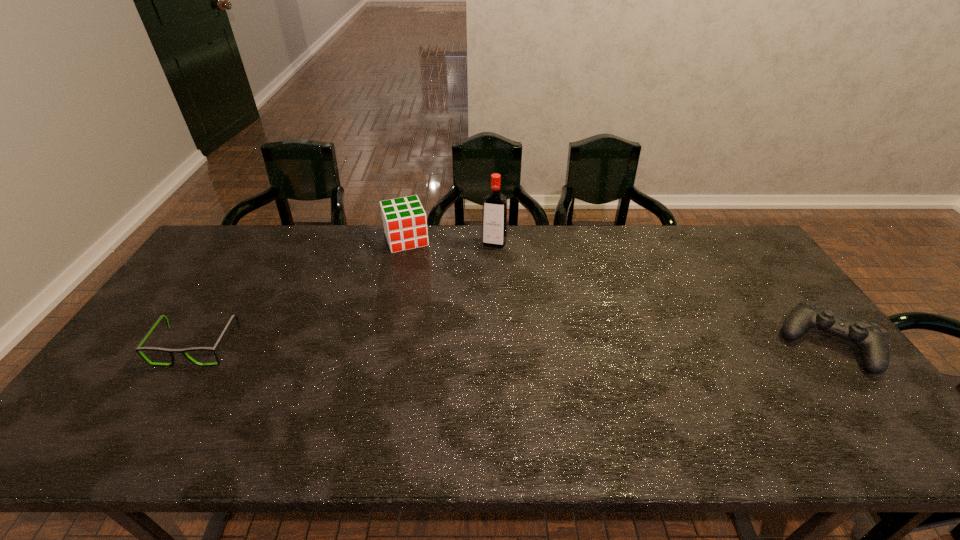
You are a GUI agent. You are given a task and a screenshot of the screen. Output one action in this format:
    pyautogui.click(x=<x>, y=<y>)
    Task: Click on the vacant area that lies between the control and the third shortest object
    
    Given the screenshot: What is the action you would take?
    pyautogui.click(x=617, y=292)

I want to click on free space between the tallest object and the cube, so pos(450,241).

Locate an element on the screen. The image size is (960, 540). empty space that is in between the shortest object and the second tallest object is located at coordinates (301, 293).

Find the location of `vacant area that lies between the second shortest object and the second object from left to right`. vacant area that lies between the second shortest object and the second object from left to right is located at coordinates (617, 292).

Find the location of a particular element. This screenshot has width=960, height=540. vacant space that is in between the cube and the rightmost object is located at coordinates (617, 292).

At what (x,y) coordinates should I click in order to perform the action: click on object that ranks as the second closest to the rightmost object. Please return your answer as a coordinate pair (x, y). Looking at the image, I should click on (405, 225).

I want to click on object that can be found as the closest to the tallest object, so click(x=405, y=225).

Locate an element on the screen. vacant region that satisfies the following two spatial constraints: 1. on the front side of the vodka; 2. on the right side of the third object from right to left is located at coordinates pos(405,244).